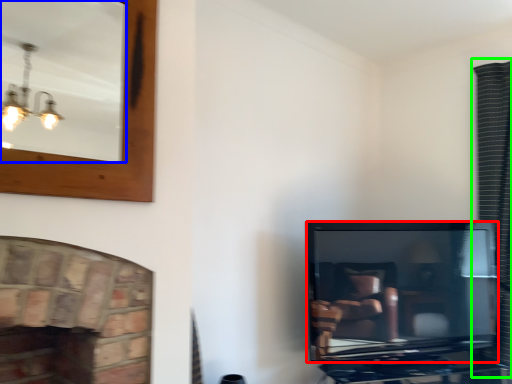
Question: Which is farther away from television (highlighted by a red box)? mirror (highlighted by a blue box) or curtain (highlighted by a green box)?

Choices:
 (A) mirror
 (B) curtain

Answer: (A)